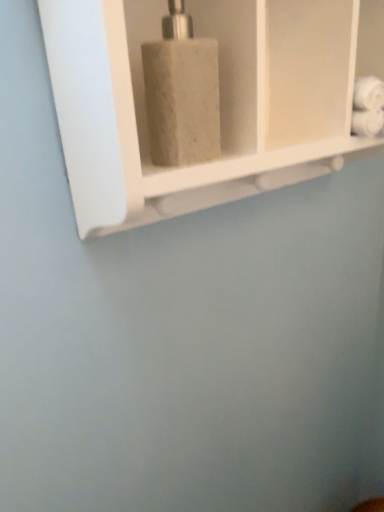
Question: In the image, is white marble soap dispenser at center positioned in front of or behind matte gray soap dispenser at center?

Choices:
 (A) front
 (B) behind

Answer: (A)

Question: From a real-world perspective, is white marble soap dispenser at center physically located above or below matte gray soap dispenser at center?

Choices:
 (A) above
 (B) below

Answer: (B)

Question: Is white marble soap dispenser at center situated inside matte gray soap dispenser at center or outside?

Choices:
 (A) inside
 (B) outside

Answer: (B)

Question: From the image's perspective, relative to white marble soap dispenser at center, is matte gray soap dispenser at center above or below?

Choices:
 (A) above
 (B) below

Answer: (B)

Question: From their relative heights in the image, would you say matte gray soap dispenser at center is taller or shorter than white marble soap dispenser at center?

Choices:
 (A) short
 (B) tall

Answer: (A)

Question: In terms of size, does matte gray soap dispenser at center appear bigger or smaller than white marble soap dispenser at center?

Choices:
 (A) big
 (B) small

Answer: (B)

Question: Considering the relative positions of matte gray soap dispenser at center and white marble soap dispenser at center in the image provided, is matte gray soap dispenser at center to the left or to the right of white marble soap dispenser at center?

Choices:
 (A) left
 (B) right

Answer: (A)